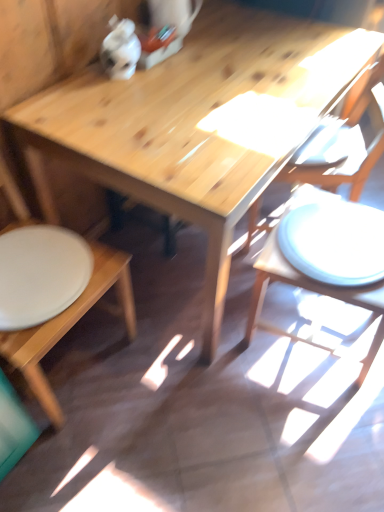
Image resolution: width=384 pixels, height=512 pixels. I want to click on free spot in front of wooden chair at lower left, positioned as the first chair in left-to-right order, so click(x=82, y=459).